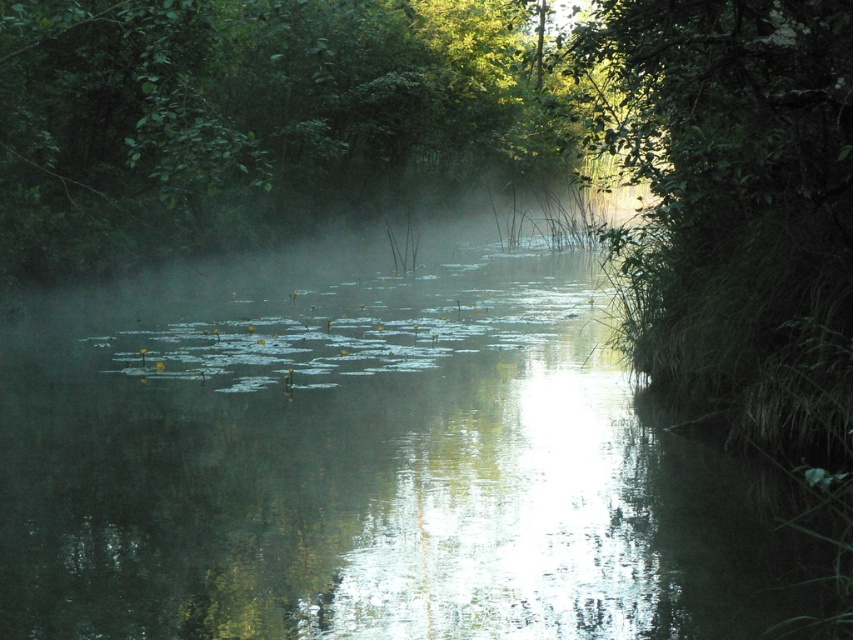
Looking at this image, you are a small boat navigating the narrow waterway. You see the green reflective water at center and the green leafy tree at upper center. Which object is wider from your perspective?

The green leafy tree at upper center is wider than the green reflective water at center.

Consider the image. You are standing on a path near the waterway and want to take a photo of the green leafy tree at upper center without the green reflective water at center in the frame. How should you adjust your camera angle?

To avoid including the green reflective water at center in the frame, you should angle your camera upward to focus on the green leafy tree at upper center, which is positioned above the water.

You are a boat captain navigating a narrow waterway. Your GPS shows a point at coordinates (364, 460). According to the scene, what is located at that point?

The green reflective water at center is located at point (364, 460).